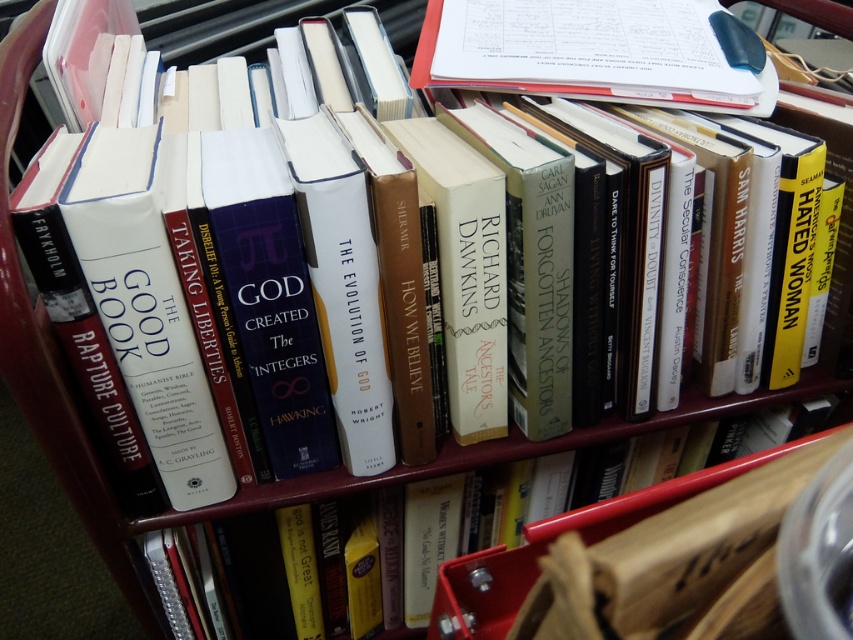
You are organizing a bookshelf and need to place the white paper notebook at upper center and the hardcover book at center. Given their widths, which one should you place first to maximize shelf space efficiency?

The white paper notebook at upper center has a greater width than the hardcover book at center. To maximize shelf space efficiency, place the wider white paper notebook at upper center first, then the narrower hardcover book at center next to it.

You are a librarian who needs to place a new book on the shelf. The new book is 12 inches wide. There is a space between the white paper notebook at upper center and another book to its right. Can the new book fit in that space?

The space between the white paper notebook at upper center and the other book is 28.27 inches. Since the new book is only 12 inches wide, it will fit comfortably in the space.

You are organizing a bookshelf and need to place a new book between the white paper notebook at upper center and the hardcover book at center. Can you fit it there?

The white paper notebook at upper center is positioned over the hardcover book at center, so there is no space between them to fit another book.